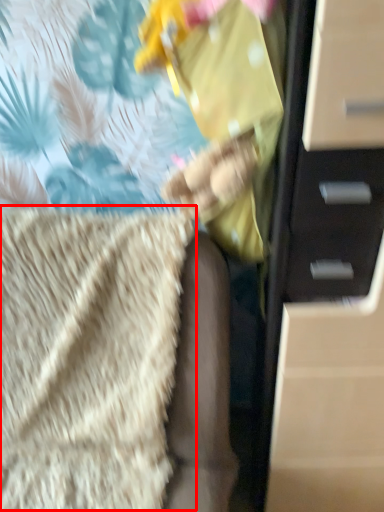
Question: From the image's perspective, what is the correct spatial relationship of blanket (annotated by the red box) in relation to chest of drawers?

Choices:
 (A) above
 (B) below

Answer: (B)